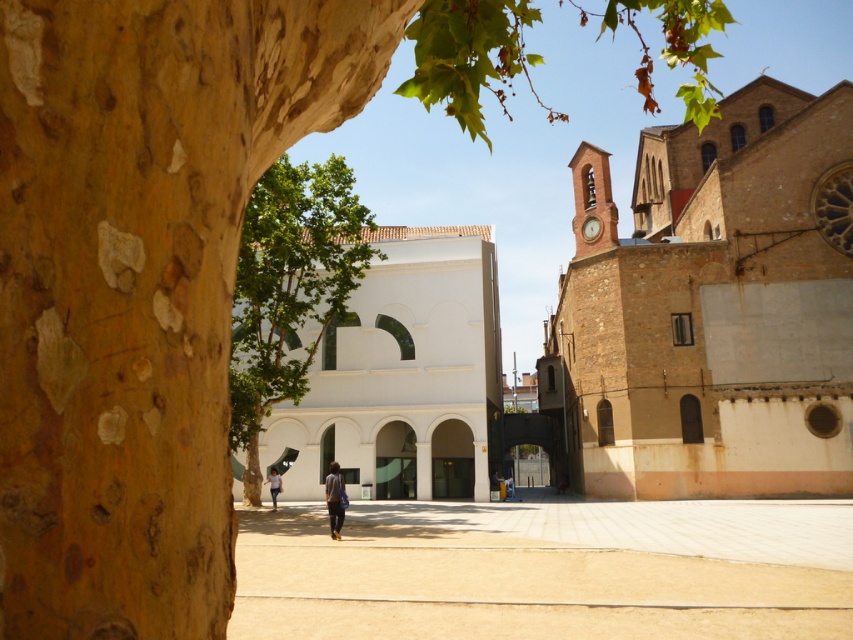
Question: In this image, where is white smooth building at center located relative to denim jacket at center?

Choices:
 (A) above
 (B) below

Answer: (A)

Question: Is white smooth building at center below denim jacket at center?

Choices:
 (A) no
 (B) yes

Answer: (A)

Question: Does brown brick church at upper right lie in front of white smooth building at center?

Choices:
 (A) no
 (B) yes

Answer: (B)

Question: Considering the real-world distances, which object is closest to the denim jacket at center?

Choices:
 (A) brown brick church at upper right
 (B) white smooth building at center
 (C) light brown leather jacket at center

Answer: (C)

Question: Which is nearer to the brown brick church at upper right?

Choices:
 (A) light brown leather jacket at center
 (B) white smooth building at center
 (C) denim jacket at center

Answer: (B)

Question: Which point is closer to the camera?

Choices:
 (A) (334, 461)
 (B) (843, 372)
 (C) (281, 488)
 (D) (368, 280)

Answer: (A)